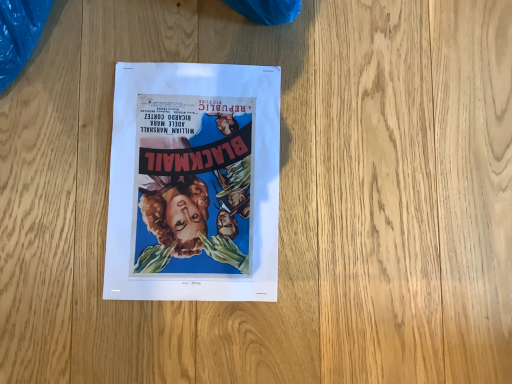
Identify the location of blank space situated above matte paper poster at center (from a real-world perspective). The image size is (512, 384). (188, 177).